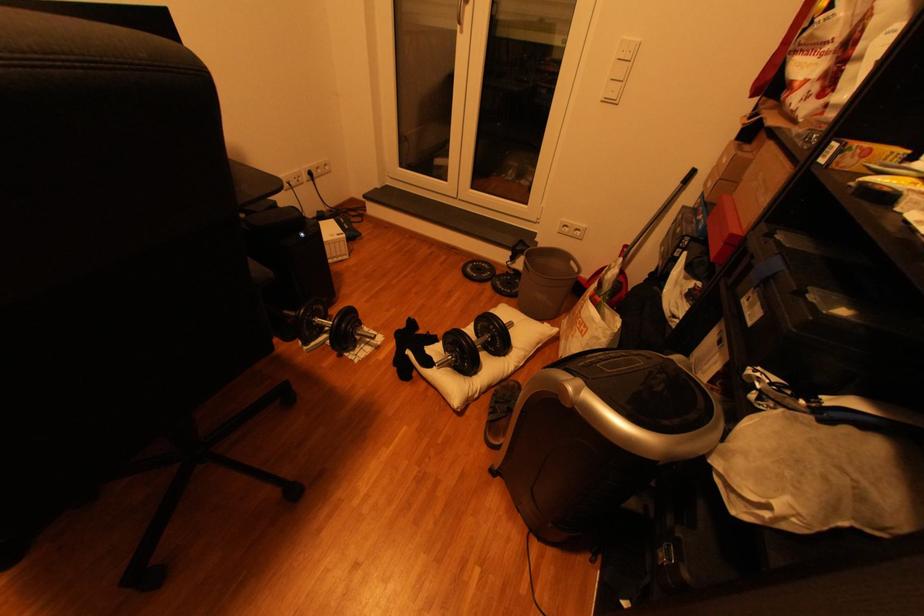
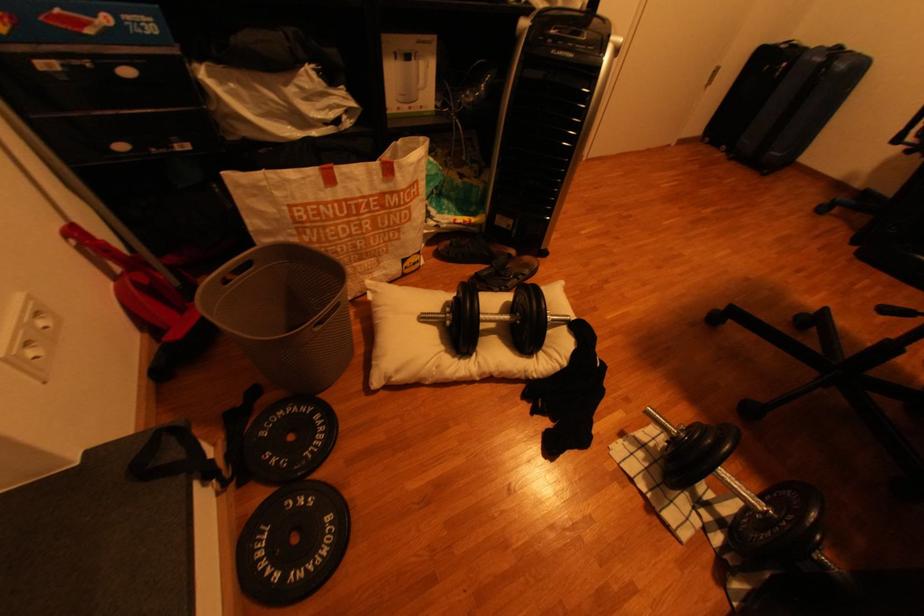
Locate, in the second image, the point that corresponds to pixel 518 292 in the first image.

(325, 419)